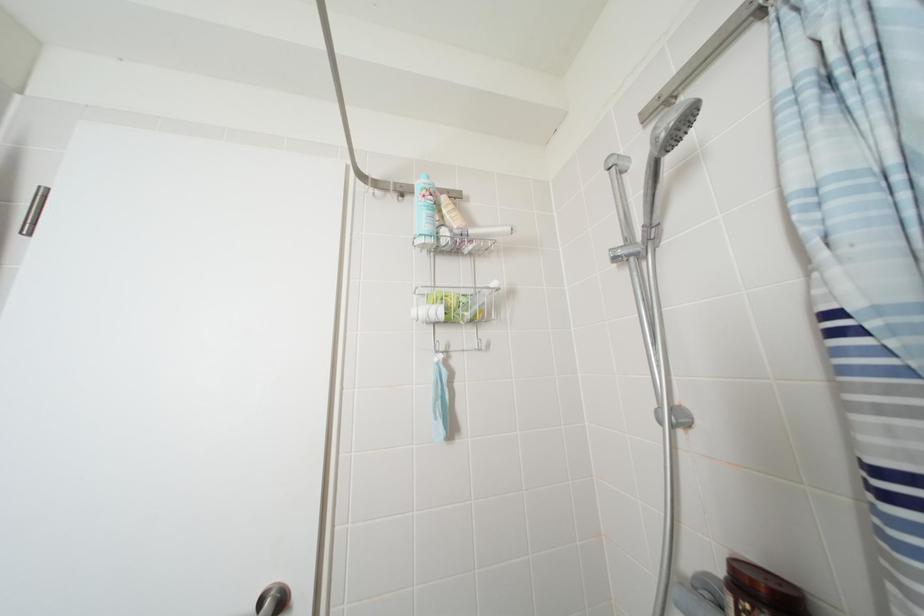
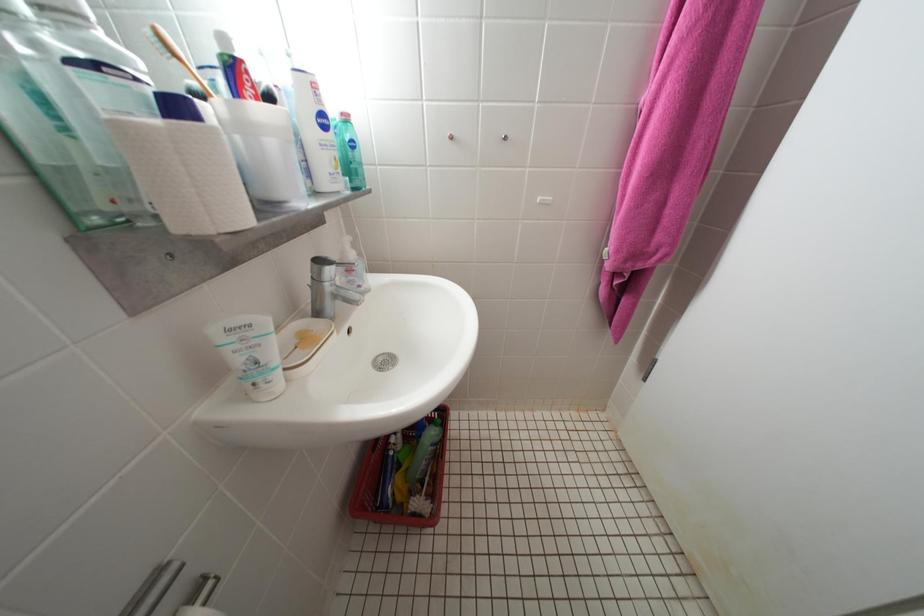
The first image is from the beginning of the video and the second image is from the end. How did the camera likely rotate when shooting the video?

The rotation direction of the camera is left-down.